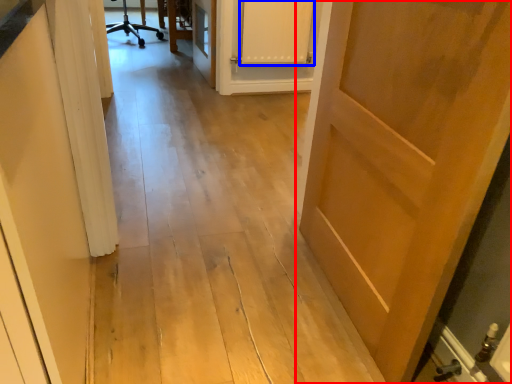
Question: Which object is further to the camera taking this photo, door (highlighted by a red box) or cabinetry (highlighted by a blue box)?

Choices:
 (A) door
 (B) cabinetry

Answer: (B)